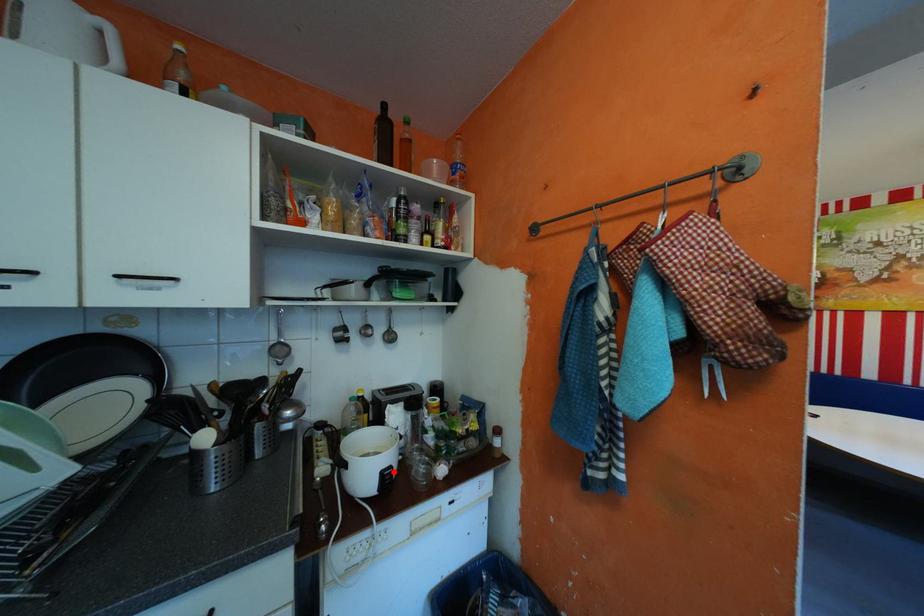
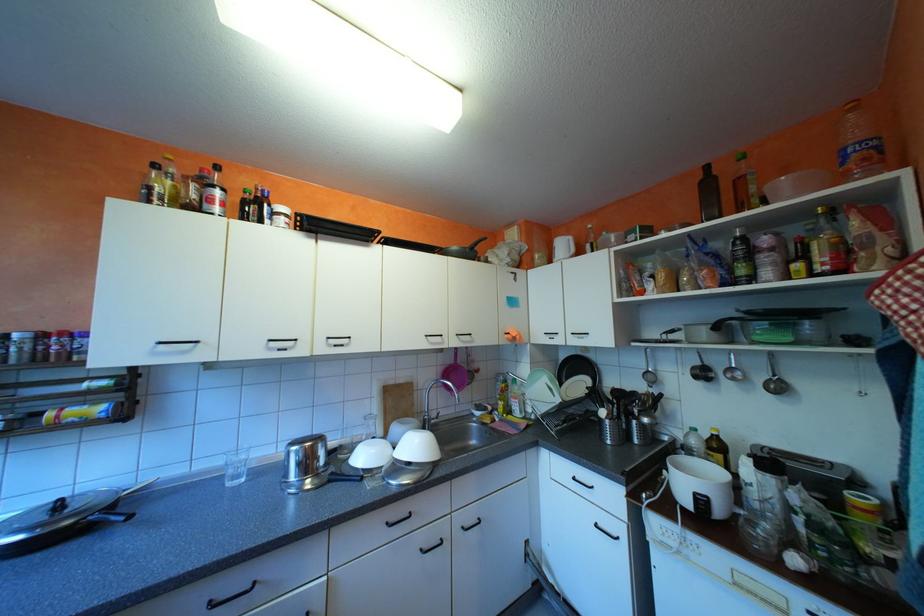
Find the pixel in the second image that matches the highlighted location in the first image.

(708, 493)